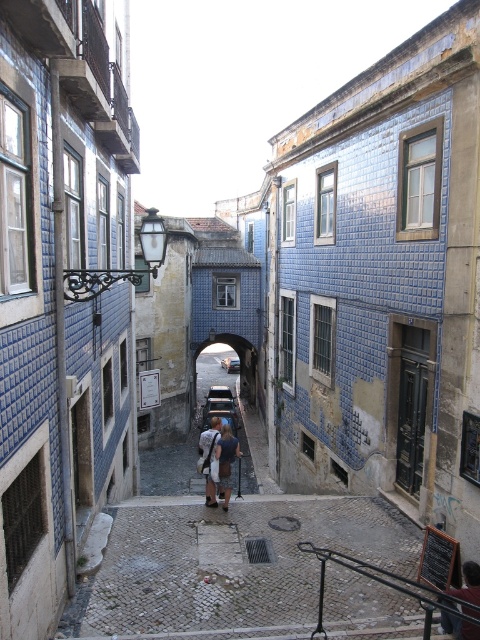
You are a tourist standing at the entrance of the narrow street scene. You see a denim jacket at center and a dark blue jeans at center. Which clothing item is closer to you?

The denim jacket at center is closer to you because the dark blue jeans at center is behind it.

You are standing at the beginning of the narrow street and want to walk towards the archway at the end. There are two points marked on the ground ahead of you, point A at coordinates point A is point (453, 592) and point B at coordinates point B is point (232, 360). Which point will you encounter first while walking towards the archway?

Point A at coordinates point A is point (453, 592) will be encountered first because it is in front of point B at coordinates point B is point (232, 360) along the path towards the archway.